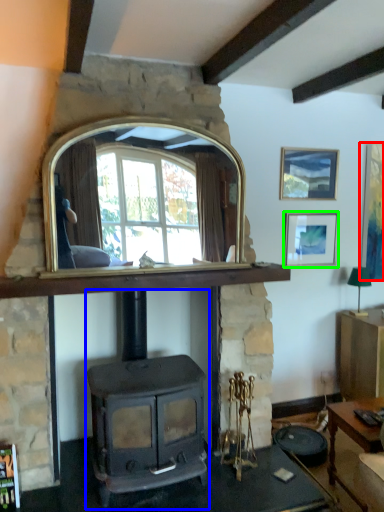
Question: Which object is the farthest from picture frame (highlighted by a red box)? Choose among these: wood burning stove (highlighted by a blue box) or picture frame (highlighted by a green box).

Choices:
 (A) wood burning stove
 (B) picture frame

Answer: (A)